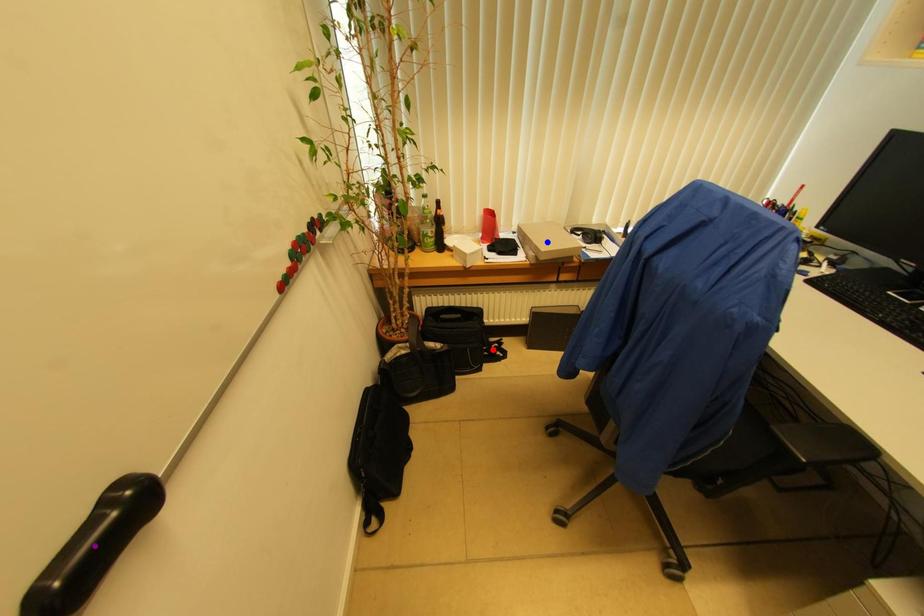
Order these from farthest to nearest:
blue point, purple point, red point

red point, blue point, purple point